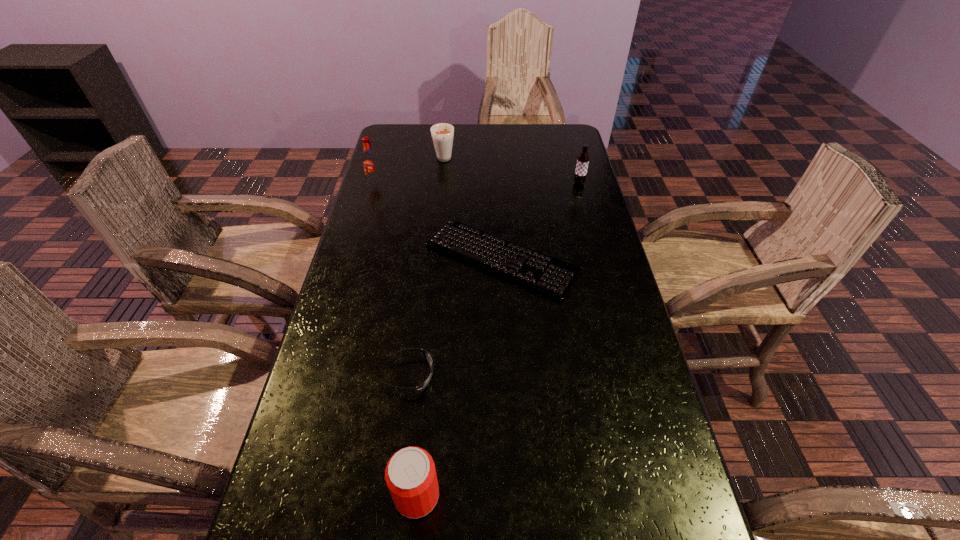
Identify the location of vacant space at the right edge. The width and height of the screenshot is (960, 540). (580, 384).

Identify the location of vacant point at the far left corner. (391, 150).

At what (x,y) coordinates should I click in order to perform the action: click on vacant region between the sunglasses and the beer can. Please return your answer as a coordinate pair (x, y). Looking at the image, I should click on (413, 435).

What are the coordinates of `free space that is in between the leftmost object and the second root beer from left to right` in the screenshot? It's located at (409, 172).

The height and width of the screenshot is (540, 960). What are the coordinates of `vacant space in between the fifth tallest object and the rightmost root beer` in the screenshot? It's located at (494, 279).

Locate an element on the screen. This screenshot has width=960, height=540. vacant area between the second nearest object and the leftmost root beer is located at coordinates (392, 280).

At what (x,y) coordinates should I click in order to perform the action: click on vacant area between the second root beer from right to left and the rightmost object. Please return your answer as a coordinate pair (x, y). Image resolution: width=960 pixels, height=540 pixels. Looking at the image, I should click on coord(512,172).

The height and width of the screenshot is (540, 960). Identify the location of vacant point located between the farthest object and the sunglasses. (426, 267).

This screenshot has height=540, width=960. I want to click on unoccupied area between the rightmost object and the nearest object, so click(498, 339).

This screenshot has height=540, width=960. I want to click on free point between the fifth farthest object and the leftmost root beer, so click(392, 280).